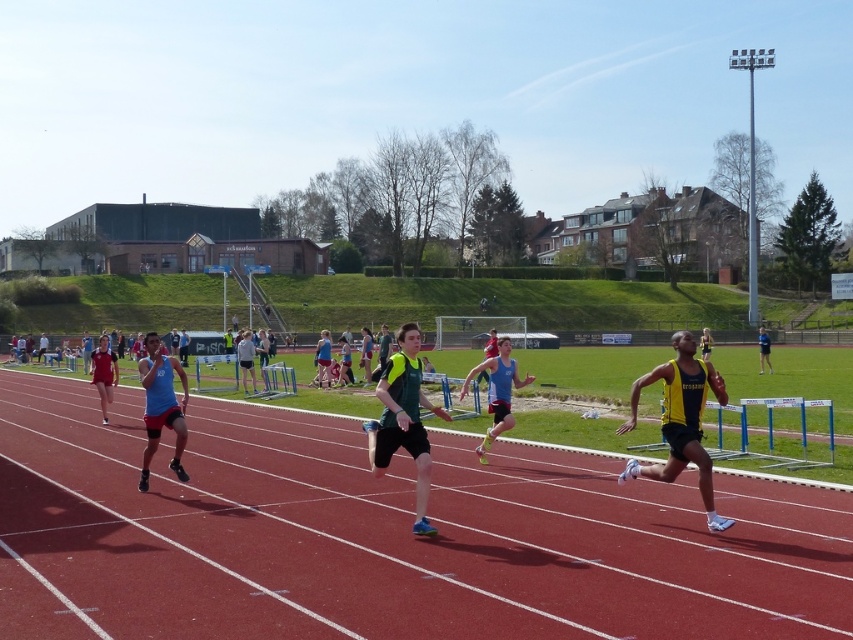
Question: Does matte red shorts at left come in front of yellow-green jersey at center?

Choices:
 (A) yes
 (B) no

Answer: (A)

Question: Is the position of rubberized red track at center more distant than that of blue fabric running suit at center?

Choices:
 (A) yes
 (B) no

Answer: (B)

Question: Among these objects, which one is nearest to the camera?

Choices:
 (A) blue matte tank top at center
 (B) rubberized red track at center
 (C) yellow-green jersey at center
 (D) yellow/black athletic uniform at right

Answer: (B)

Question: Which object is closer to the camera taking this photo?

Choices:
 (A) rubberized red track at center
 (B) green/yellow athletic top at center
 (C) yellow-green jersey at center
 (D) yellow/black athletic uniform at right

Answer: (A)

Question: Which object is positioned closest to the rubberized red track at center?

Choices:
 (A) yellow/black athletic uniform at right
 (B) green/yellow athletic top at center
 (C) matte red shorts at left
 (D) blue fabric running suit at center

Answer: (B)

Question: Observing the image, what is the correct spatial positioning of yellow/black athletic uniform at right in reference to blue fabric running suit at center?

Choices:
 (A) right
 (B) left

Answer: (A)